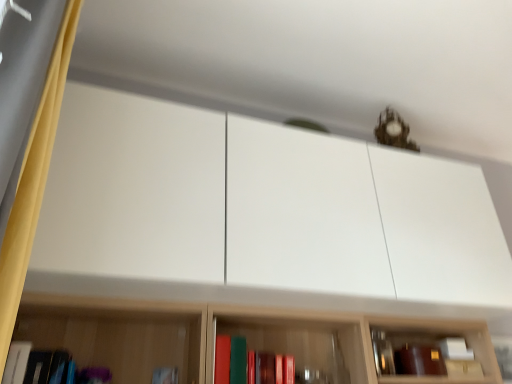
Question: Does matte red book at center, which is the third book from left to right, appear on the right side of yellow fabric curtain at left?

Choices:
 (A) yes
 (B) no

Answer: (A)

Question: Is matte red book at center, which is the third book from left to right, thinner than yellow fabric curtain at left?

Choices:
 (A) no
 (B) yes

Answer: (A)

Question: From the image's perspective, is matte red book at center, the first book when ordered from right to left, above yellow fabric curtain at left?

Choices:
 (A) no
 (B) yes

Answer: (A)

Question: Is matte red book at center, which is the third book from left to right, oriented towards yellow fabric curtain at left?

Choices:
 (A) yes
 (B) no

Answer: (B)

Question: Is matte red book at center, the first book when ordered from right to left, placed right next to yellow fabric curtain at left?

Choices:
 (A) no
 (B) yes

Answer: (A)

Question: Is point (7, 226) closer or farther from the camera than point (15, 369)?

Choices:
 (A) closer
 (B) farther

Answer: (A)

Question: Looking at their shapes, would you say yellow fabric curtain at left is wider or thinner than matte black book at lower left, which is counted as the 1th book, starting from the left?

Choices:
 (A) wide
 (B) thin

Answer: (B)

Question: From their relative heights in the image, would you say yellow fabric curtain at left is taller or shorter than matte black book at lower left, placed as the third book when sorted from right to left?

Choices:
 (A) short
 (B) tall

Answer: (B)

Question: Is yellow fabric curtain at left in front of or behind matte black book at lower left, which is counted as the 1th book, starting from the left, in the image?

Choices:
 (A) behind
 (B) front

Answer: (B)

Question: Considering the positions of matte red book at center, which is the third book from left to right, and matte white book at lower left, marked as the second book in a left-to-right arrangement, in the image, is matte red book at center, which is the third book from left to right, wider or thinner than matte white book at lower left, marked as the second book in a left-to-right arrangement,?

Choices:
 (A) wide
 (B) thin

Answer: (A)

Question: Does point (247, 372) appear closer or farther from the camera than point (158, 382)?

Choices:
 (A) closer
 (B) farther

Answer: (B)

Question: Is matte red book at center, the first book when ordered from right to left, taller or shorter than matte white book at lower left, marked as the second book in a left-to-right arrangement?

Choices:
 (A) tall
 (B) short

Answer: (B)

Question: From a real-world perspective, is matte red book at center, the first book when ordered from right to left, physically located above or below matte white book at lower left, marked as the second book in a right-to-left arrangement?

Choices:
 (A) below
 (B) above

Answer: (B)

Question: Relative to yellow fabric curtain at left, is matte red book at center, which is the third book from left to right, in front or behind?

Choices:
 (A) behind
 (B) front

Answer: (A)

Question: From the image's perspective, is matte red book at center, the first book when ordered from right to left, positioned above or below yellow fabric curtain at left?

Choices:
 (A) above
 (B) below

Answer: (B)